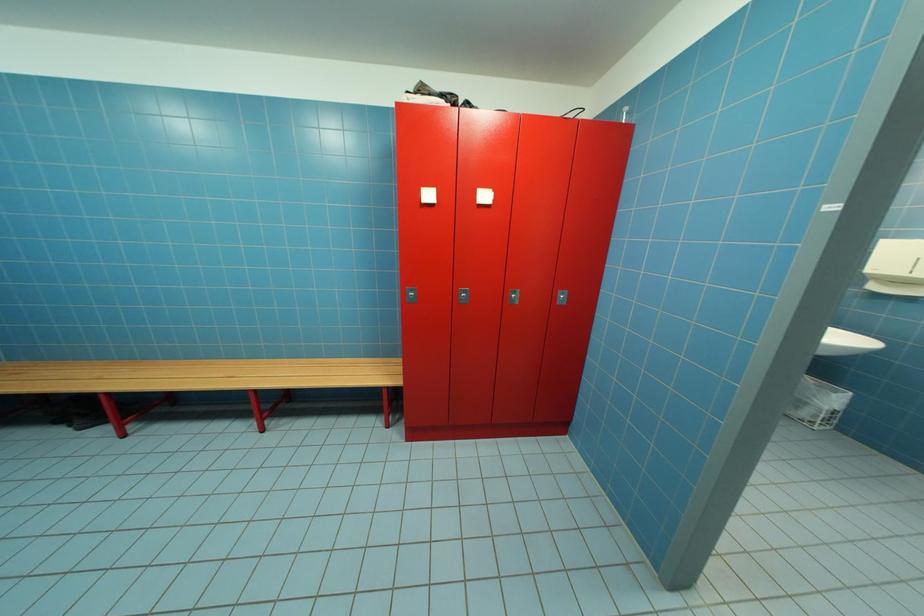
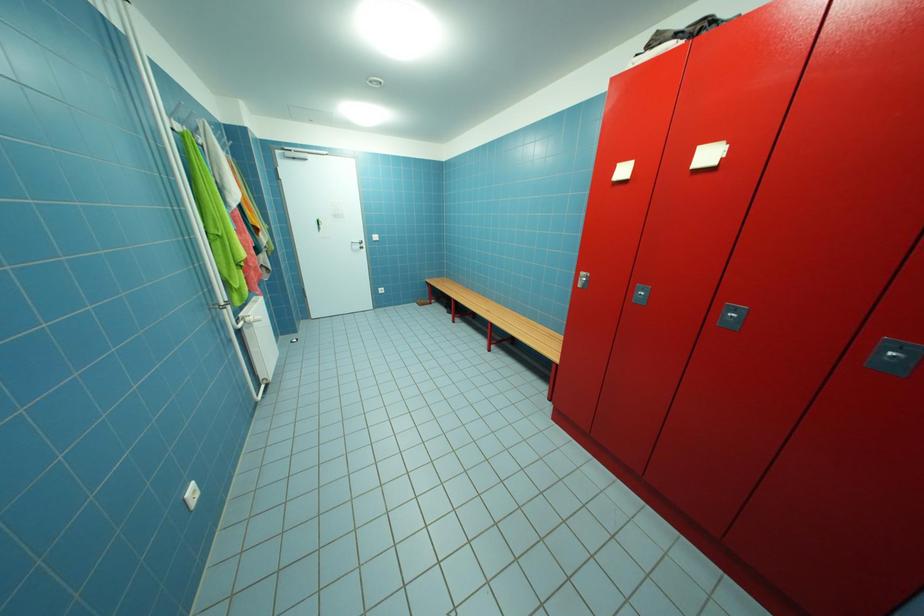
Question: The camera is either moving clockwise (left) or counter-clockwise (right) around the object. The first image is from the beginning of the video and the second image is from the end. Is the camera moving left or right when shooting the video?

Choices:
 (A) Left
 (B) Right

Answer: (B)